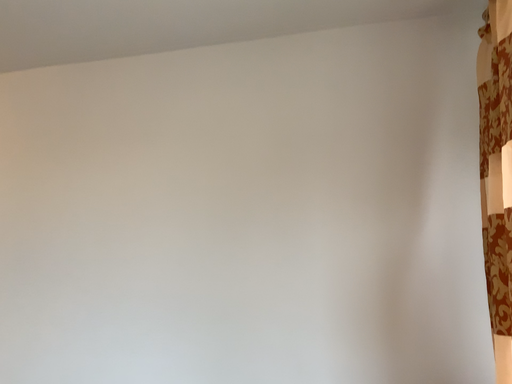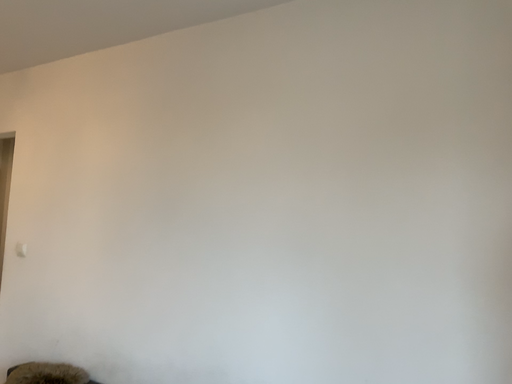
Question: How did the camera likely rotate when shooting the video?

Choices:
 (A) rotated upward
 (B) rotated downward

Answer: (B)